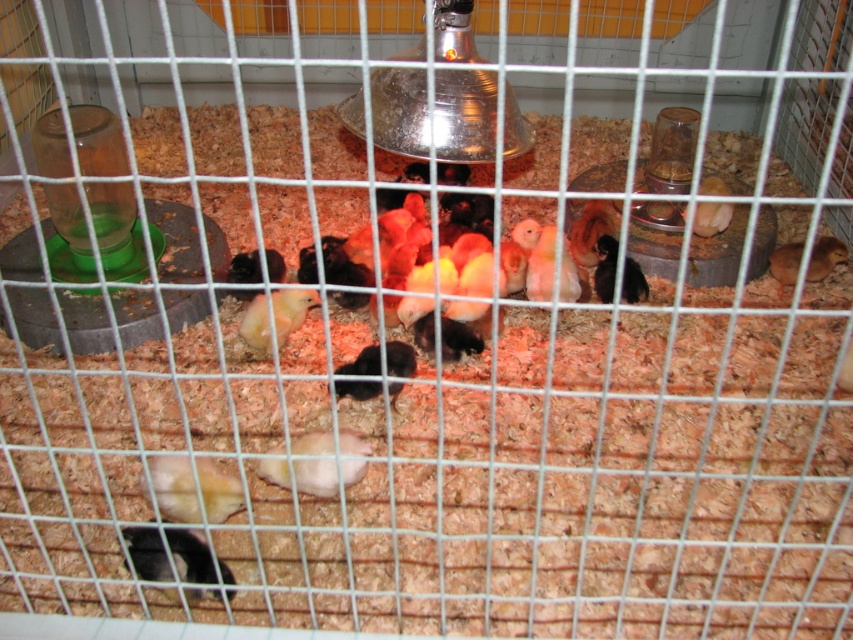
Does black fur rabbit at lower left have a lesser width compared to white matte chicken at center?

Correct, black fur rabbit at lower left's width is less than white matte chicken at center's.

Who is more distant from viewer, (158,557) or (282,468)?

Positioned behind is point (282,468).

Locate an element on the screen. black fur rabbit at lower left is located at coordinates (148, 554).

Can you confirm if white matte chicken at center is taller than yellow matte chick at center?

In fact, white matte chicken at center may be shorter than yellow matte chick at center.

What do you see at coordinates (315, 476) in the screenshot?
I see `white matte chicken at center` at bounding box center [315, 476].

You are a GUI agent. You are given a task and a screenshot of the screen. Output one action in this format:
    pyautogui.click(x=<x>, y=<y>)
    Task: Click on the white matte chicken at center
    
    Given the screenshot: What is the action you would take?
    pyautogui.click(x=315, y=476)

Is point (289, 324) positioned behind point (393, 371)?

Yes, it is.

Identify the location of yellow matte chick at center. (289, 308).